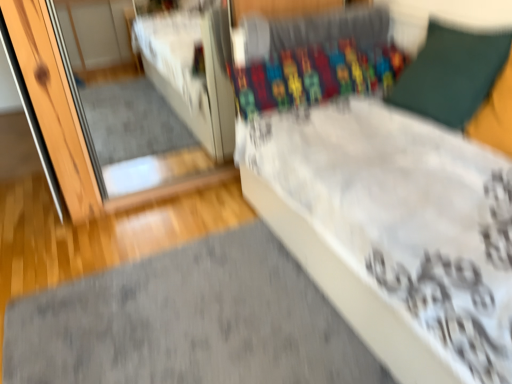
Question: Considering the positions of white glossy mirror at upper left and green fabric pillow at upper right in the image, is white glossy mirror at upper left wider or thinner than green fabric pillow at upper right?

Choices:
 (A) thin
 (B) wide

Answer: (B)

Question: Is white glossy mirror at upper left to the left or to the right of green fabric pillow at upper right in the image?

Choices:
 (A) left
 (B) right

Answer: (A)

Question: Which object is the farthest from the green fabric pillow at upper right?

Choices:
 (A) gray soft mat at lower left
 (B) white glossy mirror at upper left

Answer: (B)

Question: Which of these objects is positioned farthest from the white glossy mirror at upper left?

Choices:
 (A) green fabric pillow at upper right
 (B) gray soft mat at lower left

Answer: (A)